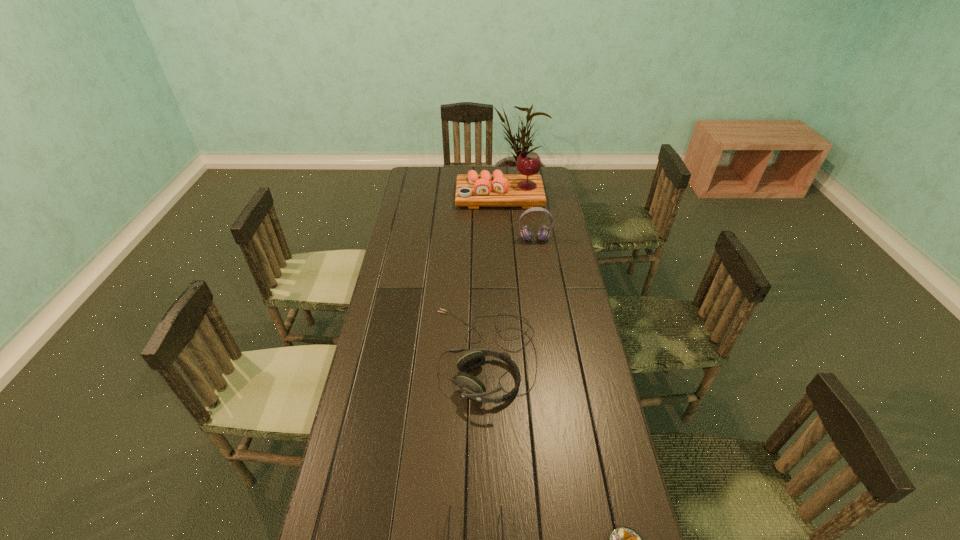
In order to click on vacant area that lies between the third shortest object and the second tallest object in this screenshot , I will do `click(510, 297)`.

Where is `empty space between the nearer headset and the second tallest object`? The image size is (960, 540). empty space between the nearer headset and the second tallest object is located at coordinates (510, 297).

Where is `object that is the closest to the shorter headset`? This screenshot has width=960, height=540. object that is the closest to the shorter headset is located at coordinates (449, 506).

The height and width of the screenshot is (540, 960). Identify the location of object that can be found as the closest to the pastry. pos(449,506).

Locate an element on the screen. This screenshot has width=960, height=540. free region that satisfies the following two spatial constraints: 1. on the front side of the platter; 2. on the outer surface of the third tallest object is located at coordinates (510, 355).